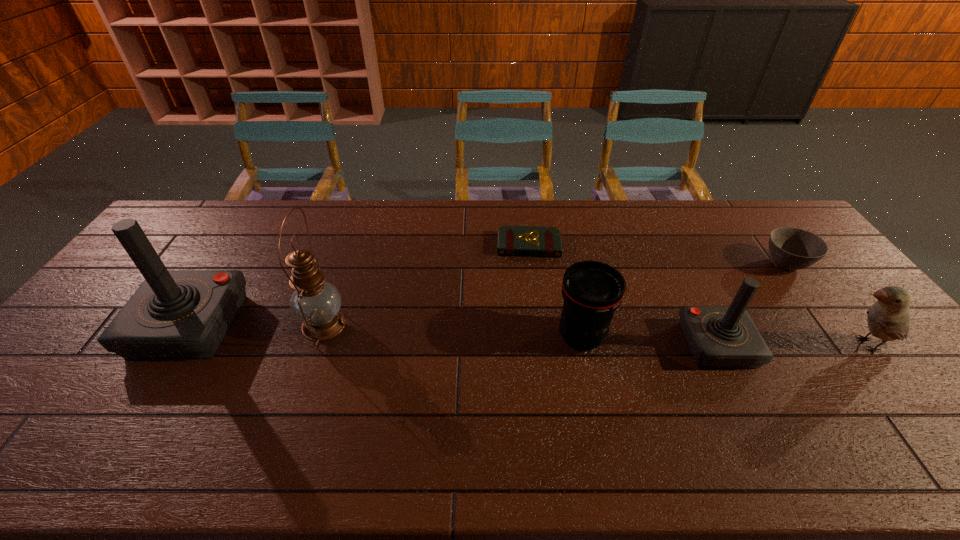
Where is `vacant region at the far edge`? vacant region at the far edge is located at coordinates (474, 200).

You are a GUI agent. You are given a task and a screenshot of the screen. Output one action in this format:
    pyautogui.click(x=<x>, y=<y>)
    Task: Click on the free space at the near edge of the desktop
    The width and height of the screenshot is (960, 540).
    Given the screenshot: What is the action you would take?
    pyautogui.click(x=524, y=409)

Find the location of a particular element. The width and height of the screenshot is (960, 540). vacant area at the left edge of the desktop is located at coordinates (78, 347).

In the image, there is a desktop. Identify the location of free space at the far left corner. The width and height of the screenshot is (960, 540). (200, 208).

Locate an element on the screen. The width and height of the screenshot is (960, 540). free space at the near left corner of the desktop is located at coordinates (29, 398).

At what (x,y) coordinates should I click in order to perform the action: click on free space at the far right corner of the desktop. Please return your answer as a coordinate pair (x, y). The image size is (960, 540). Looking at the image, I should click on (780, 218).

Identify the location of empty space between the bowl and the bird. This screenshot has width=960, height=540. (826, 304).

Find the location of a particular element. vacant area that lies between the shortest object and the telephoto lens is located at coordinates (555, 291).

At what (x,y) coordinates should I click in order to perform the action: click on vacant area that lies between the oil lamp and the telephoto lens. Please return your answer as a coordinate pair (x, y). The width and height of the screenshot is (960, 540). Looking at the image, I should click on (453, 330).

You are a GUI agent. You are given a task and a screenshot of the screen. Output one action in this format:
    pyautogui.click(x=<x>, y=<y>)
    Task: Click on the vacant space in between the sixth tallest object and the shortest object
    Image resolution: width=960 pixels, height=540 pixels.
    Given the screenshot: What is the action you would take?
    pyautogui.click(x=657, y=254)